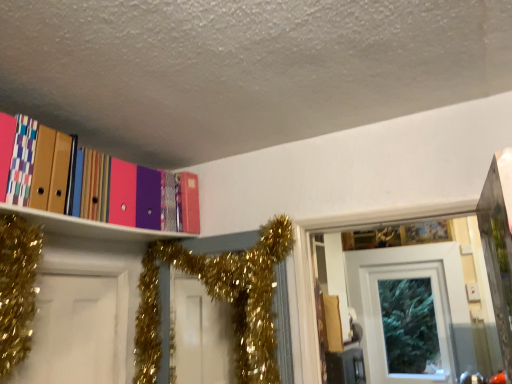
Question: From the image's perspective, is gold glitter garland at upper center located beneath white glossy door at upper center?

Choices:
 (A) no
 (B) yes

Answer: (A)

Question: Is gold glitter garland at upper center facing towards white glossy door at upper center?

Choices:
 (A) yes
 (B) no

Answer: (B)

Question: From a real-world perspective, is gold glitter garland at upper center below white glossy door at upper center?

Choices:
 (A) yes
 (B) no

Answer: (B)

Question: Is the depth of gold glitter garland at upper center greater than that of white glossy door at upper center?

Choices:
 (A) no
 (B) yes

Answer: (A)

Question: Is gold glitter garland at upper center with white glossy door at upper center?

Choices:
 (A) no
 (B) yes

Answer: (A)

Question: Considering their positions, is matte plastic folders at upper left located in front of or behind gold glitter garland at upper center?

Choices:
 (A) behind
 (B) front

Answer: (B)

Question: Considering the positions of matte plastic folders at upper left and gold glitter garland at upper center in the image, is matte plastic folders at upper left bigger or smaller than gold glitter garland at upper center?

Choices:
 (A) big
 (B) small

Answer: (B)

Question: Considering the positions of matte plastic folders at upper left and gold glitter garland at upper center in the image, is matte plastic folders at upper left taller or shorter than gold glitter garland at upper center?

Choices:
 (A) short
 (B) tall

Answer: (A)

Question: From the image's perspective, relative to gold glitter garland at upper center, is matte plastic folders at upper left above or below?

Choices:
 (A) above
 (B) below

Answer: (A)

Question: From a real-world perspective, is white glossy door at upper center positioned above or below gold glitter garland at upper center?

Choices:
 (A) below
 (B) above

Answer: (A)

Question: Is white glossy door at upper center taller or shorter than gold glitter garland at upper center?

Choices:
 (A) tall
 (B) short

Answer: (A)

Question: Is white glossy door at upper center in front of or behind gold glitter garland at upper center in the image?

Choices:
 (A) front
 (B) behind

Answer: (B)

Question: Is point (368, 258) closer or farther from the camera than point (137, 332)?

Choices:
 (A) closer
 (B) farther

Answer: (B)

Question: From a real-world perspective, is white glossy door at upper center above or below matte plastic folders at upper left?

Choices:
 (A) above
 (B) below

Answer: (B)

Question: Is white glossy door at upper center inside the boundaries of matte plastic folders at upper left, or outside?

Choices:
 (A) outside
 (B) inside

Answer: (A)